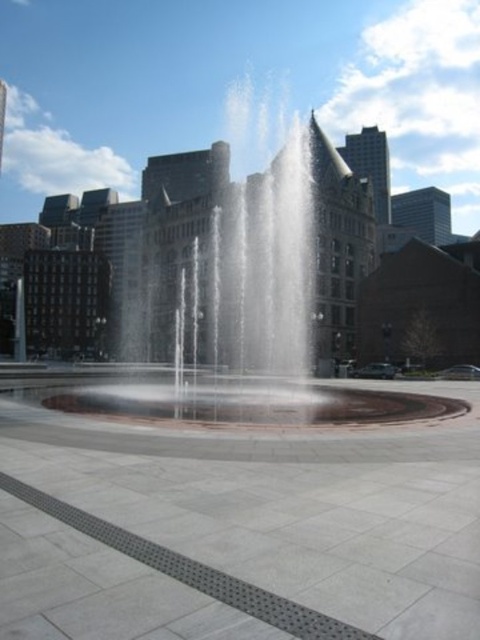
Question: Which point is closer to the camera?

Choices:
 (A) gray concrete pavement at center
 (B) clear water fountain at center

Answer: (A)

Question: Is gray concrete pavement at center positioned in front of clear water fountain at center?

Choices:
 (A) no
 (B) yes

Answer: (B)

Question: Among these points, which one is nearest to the camera?

Choices:
 (A) (312, 132)
 (B) (222, 634)

Answer: (B)

Question: Does gray concrete pavement at center have a smaller size compared to clear water fountain at center?

Choices:
 (A) yes
 (B) no

Answer: (A)

Question: Is the position of gray concrete pavement at center less distant than that of clear water fountain at center?

Choices:
 (A) yes
 (B) no

Answer: (A)